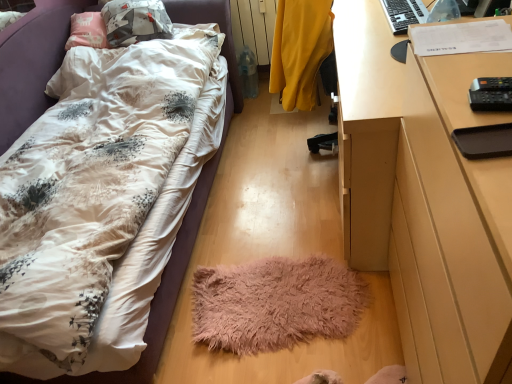
Locate an element on the screen. The height and width of the screenshot is (384, 512). vacant space behind black matte tray at right is located at coordinates (470, 88).